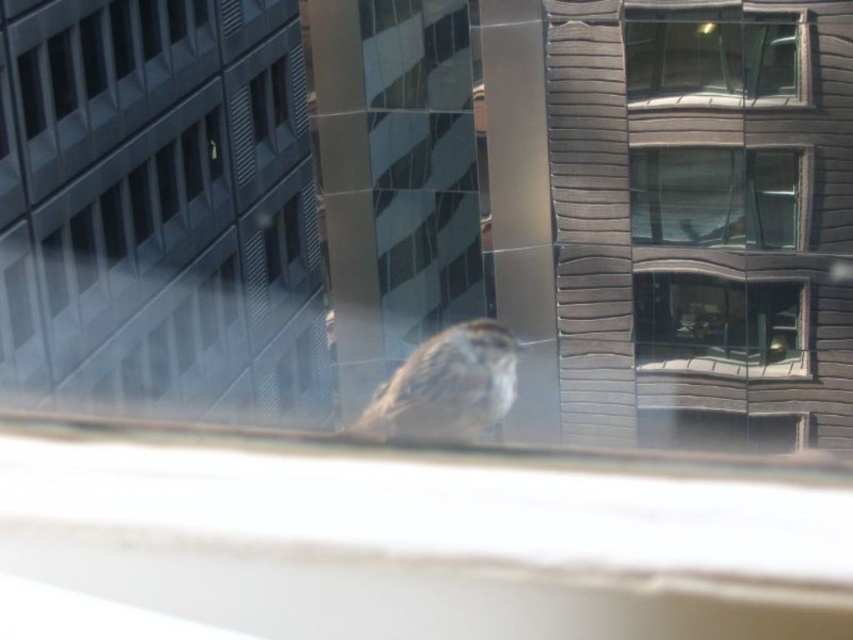
Is clear glass window at upper center above transparent glass window at center?

Yes.

Does clear glass window at upper center have a greater height compared to transparent glass window at center?

Incorrect, clear glass window at upper center's height is not larger of transparent glass window at center's.

This screenshot has height=640, width=853. Find the location of `clear glass window at upper center`. clear glass window at upper center is located at coordinates (712, 56).

Measure the distance between transparent glass window at center and clear glass window at center.

They are 71.01 centimeters apart.

Which of these two, transparent glass window at center or clear glass window at center, stands taller?

With more height is clear glass window at center.

What do you see at coordinates (715, 196) in the screenshot? I see `transparent glass window at center` at bounding box center [715, 196].

Locate an element on the screen. The height and width of the screenshot is (640, 853). transparent glass window at center is located at coordinates (715, 196).

This screenshot has height=640, width=853. Describe the element at coordinates (717, 324) in the screenshot. I see `clear glass window at center` at that location.

Is clear glass window at center smaller than brown speckled sparrow at center?

Indeed, clear glass window at center has a smaller size compared to brown speckled sparrow at center.

I want to click on clear glass window at center, so click(717, 324).

Identify the location of clear glass window at center. (717, 324).